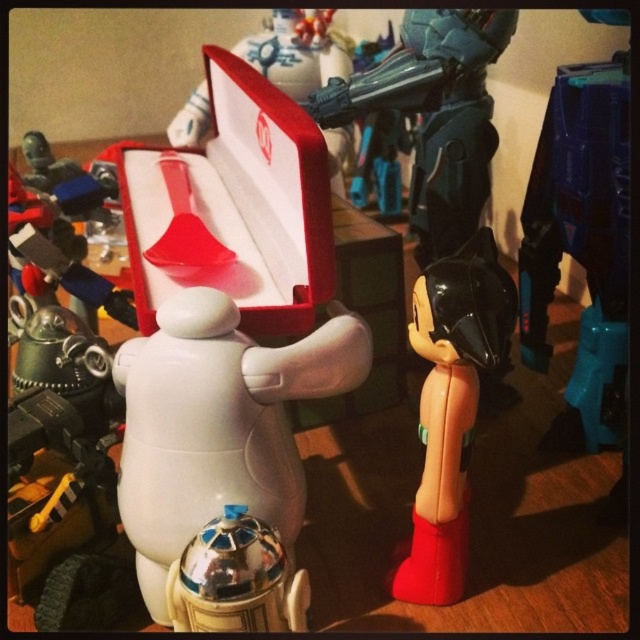
Question: Which point is closer to the camera?

Choices:
 (A) black glossy action figure at center
 (B) teal plastic robot at upper right
 (C) matte plastic spoon at center

Answer: (A)

Question: Which point is closer to the camera?

Choices:
 (A) (433, 522)
 (B) (356, 112)

Answer: (A)

Question: Does black glossy action figure at center lie in front of shiny metallic droid at center?

Choices:
 (A) no
 (B) yes

Answer: (A)

Question: Where is shiny metallic droid at center located in relation to red velvet box at center in the image?

Choices:
 (A) right
 (B) left

Answer: (A)

Question: Is black glossy action figure at center to the right of metallic blue robot at upper center from the viewer's perspective?

Choices:
 (A) yes
 (B) no

Answer: (A)

Question: Which of these objects is positioned closest to the black glossy action figure at center?

Choices:
 (A) shiny metallic droid at center
 (B) matte plastic spoon at center

Answer: (A)